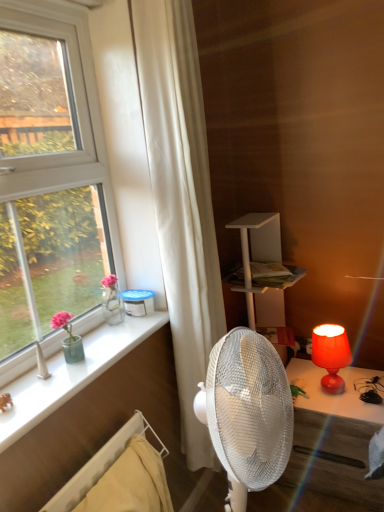
Find the location of a particular element. free space in front of matte red lamp at right is located at coordinates (346, 413).